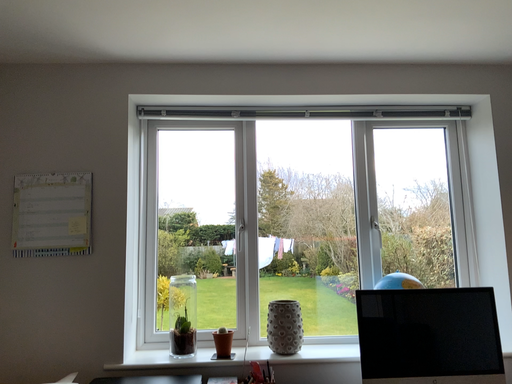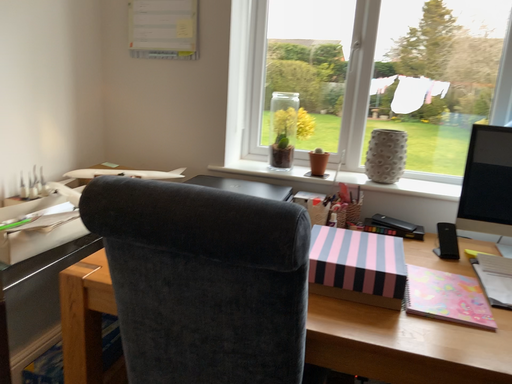
Question: How did the camera likely rotate when shooting the video?

Choices:
 (A) rotated upward
 (B) rotated downward

Answer: (B)